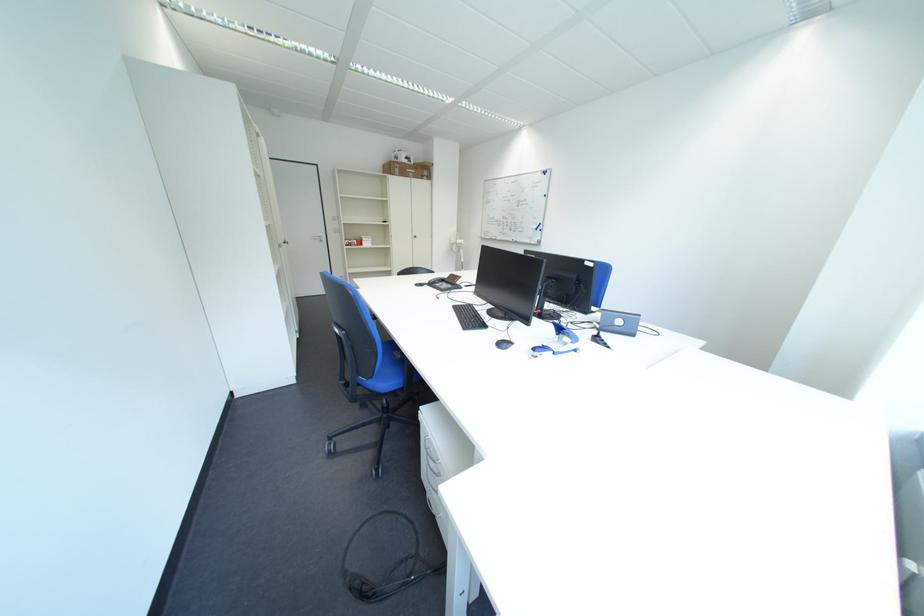
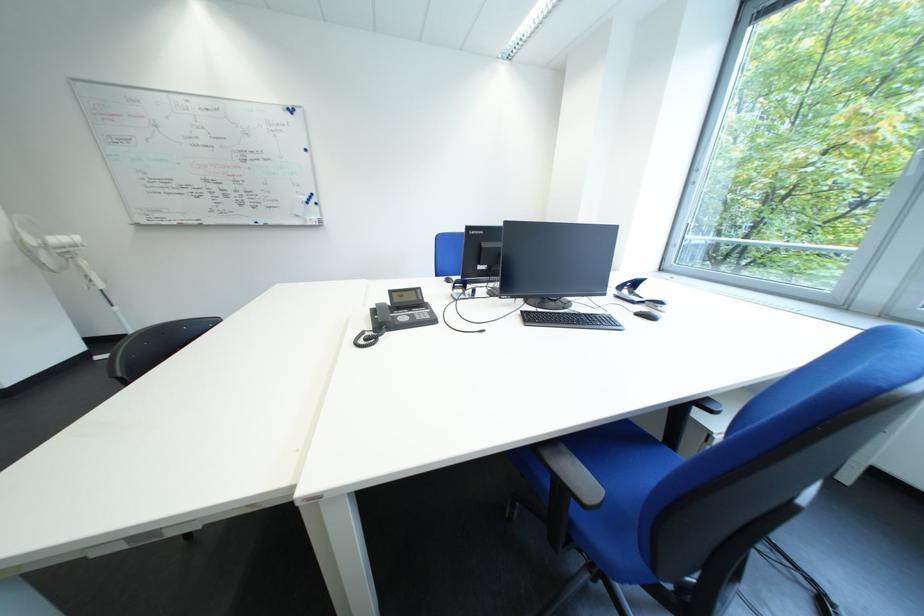
Locate, in the second image, the point that corresponds to pixel 451 286 in the first image.

(416, 320)